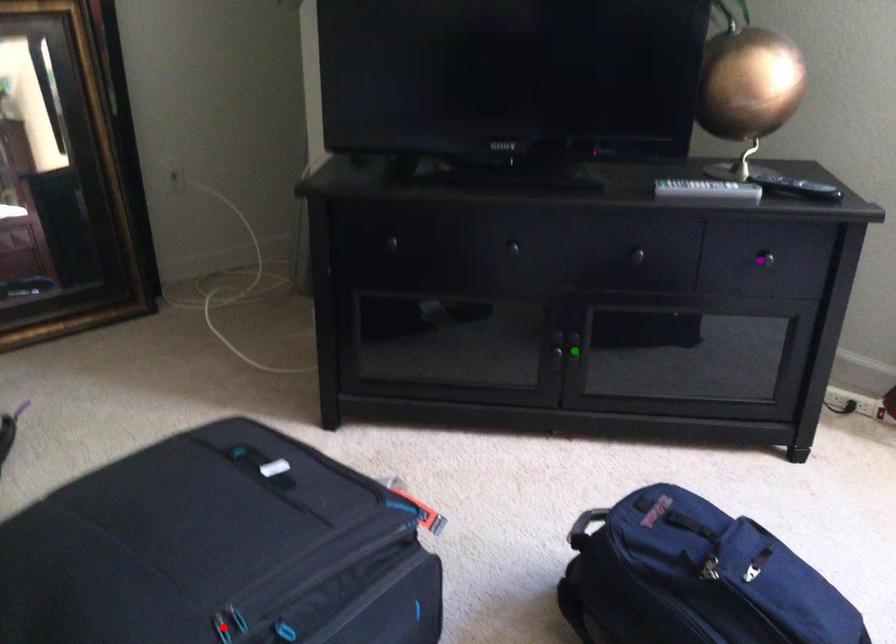
Order these from nearest to farthest:
- purple point
- red point
- green point

red point → purple point → green point